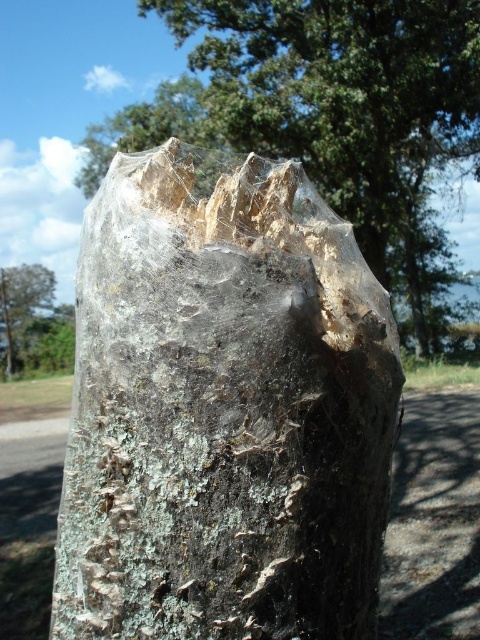
Does translucent plastic bag at center appear over green leafy tree at upper left?

Correct, translucent plastic bag at center is located above green leafy tree at upper left.

Does translucent plastic bag at center have a larger size compared to green leafy tree at upper left?

Incorrect, translucent plastic bag at center is not larger than green leafy tree at upper left.

Find the location of a particular element. translucent plastic bag at center is located at coordinates (331, 116).

Does transparent plastic tree trunk at center appear on the right side of translucent plastic bag at center?

Correct, you'll find transparent plastic tree trunk at center to the right of translucent plastic bag at center.

Is point (173, 577) less distant than point (314, 140)?

Yes, it is in front of point (314, 140).

Find the location of a particular element. transparent plastic tree trunk at center is located at coordinates (224, 412).

Is transparent plastic tree trunk at center taller than green leafy tree at upper left?

No, transparent plastic tree trunk at center is not taller than green leafy tree at upper left.

Find the location of a particular element. transparent plastic tree trunk at center is located at coordinates (224, 412).

This screenshot has height=640, width=480. I want to click on transparent plastic tree trunk at center, so (224, 412).